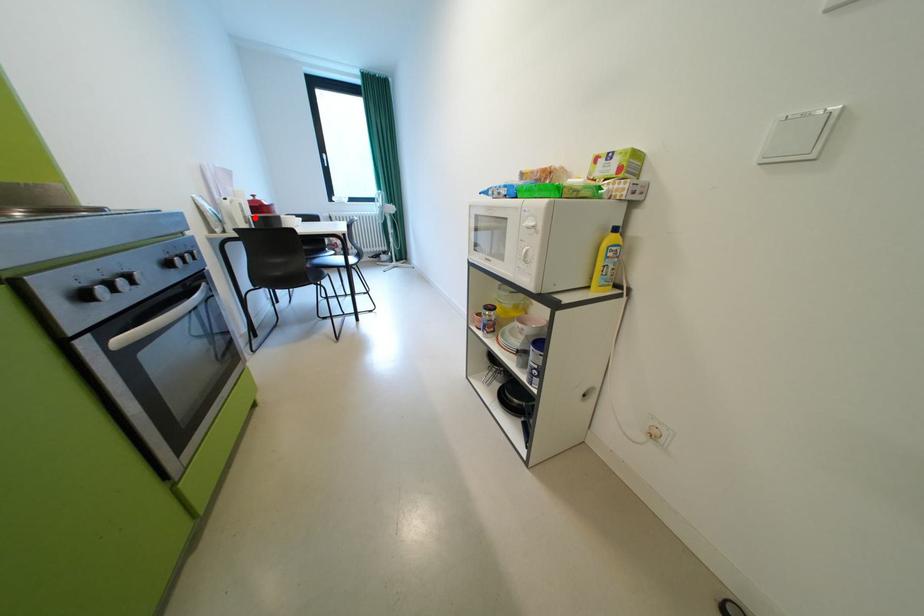
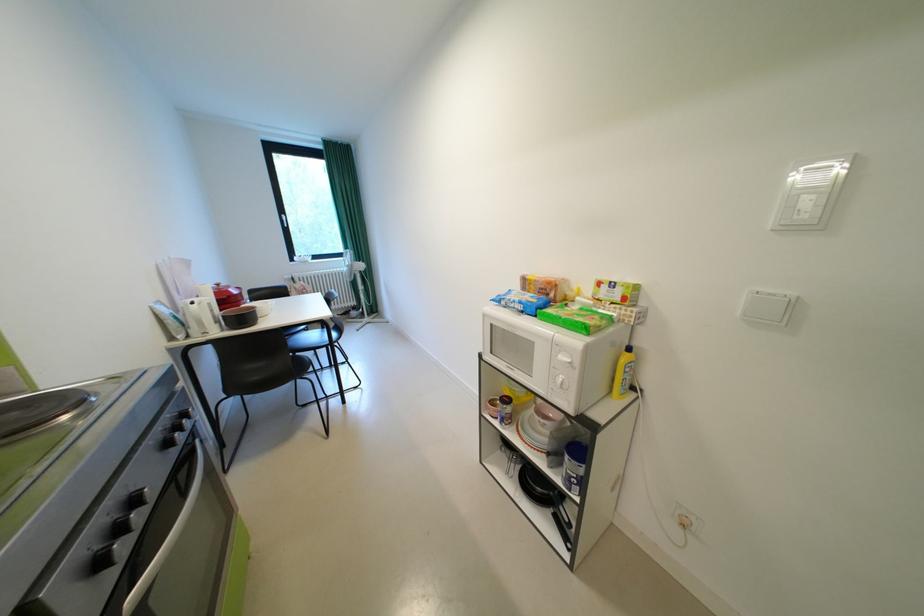
The point at the highlighted location is marked in the first image. Where is the corresponding point in the second image?

(225, 317)